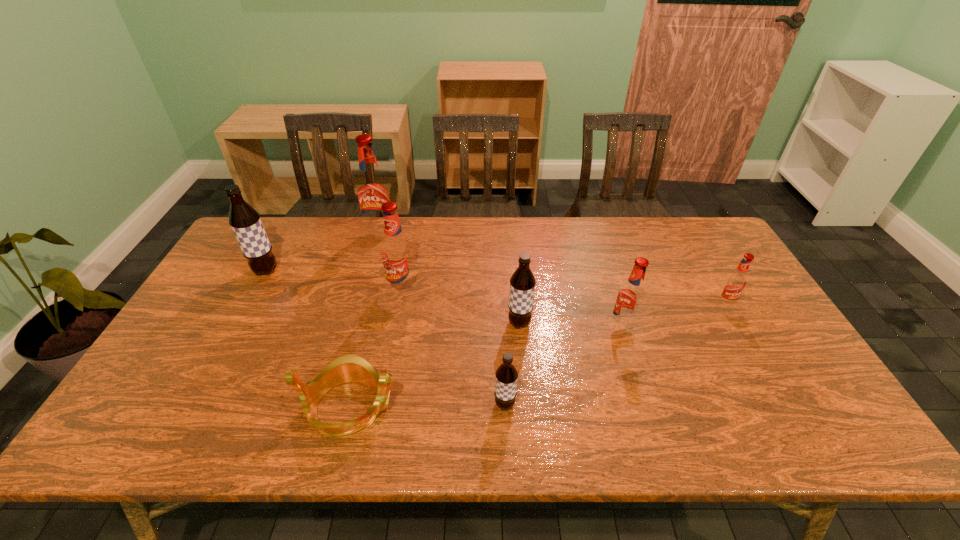
The width and height of the screenshot is (960, 540). I want to click on free space at the left edge, so click(x=197, y=313).

Image resolution: width=960 pixels, height=540 pixels. Identify the location of vacant space at the right edge of the desktop. (743, 310).

Identify the location of vacant space at the far right corner of the desktop. tap(691, 253).

Image resolution: width=960 pixels, height=540 pixels. I want to click on free space between the rightmost root beer and the tiara, so click(538, 355).

In order to click on empty location between the leftmost root beer and the second red root beer from left to right in this screenshot , I will do `click(334, 280)`.

Find the location of a particular element. free space between the tallest object and the smallest red root beer is located at coordinates (553, 269).

Find the location of a particular element. This screenshot has height=540, width=960. free space between the rightmost red root beer and the leftmost red root beer is located at coordinates (553, 269).

Identify the location of free spot between the fifth root beer from right to left and the second farthest brown root beer. (461, 306).

You are a GUI agent. You are given a task and a screenshot of the screen. Output one action in this format:
    pyautogui.click(x=<x>, y=<y>)
    Task: Click on the vacant space that is in between the seventh nearest object and the nearest brown root beer
    
    Given the screenshot: What is the action you would take?
    pyautogui.click(x=385, y=338)

You are a GUI agent. You are given a task and a screenshot of the screen. Output one action in this format:
    pyautogui.click(x=<x>, y=<y>)
    Task: Click on the blank region between the seventh object from left to right and the gold tiara
    The height and width of the screenshot is (540, 960).
    Given the screenshot: What is the action you would take?
    pyautogui.click(x=486, y=367)